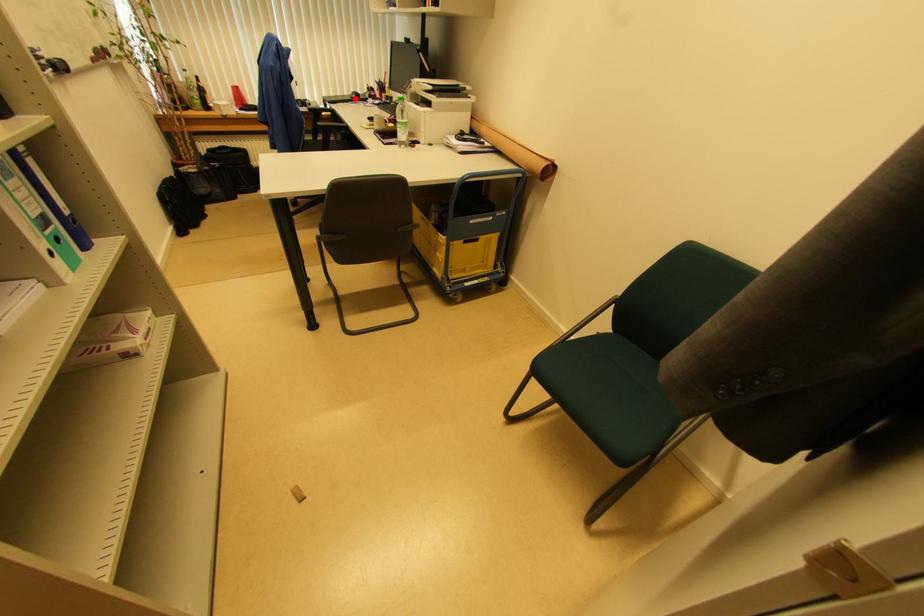
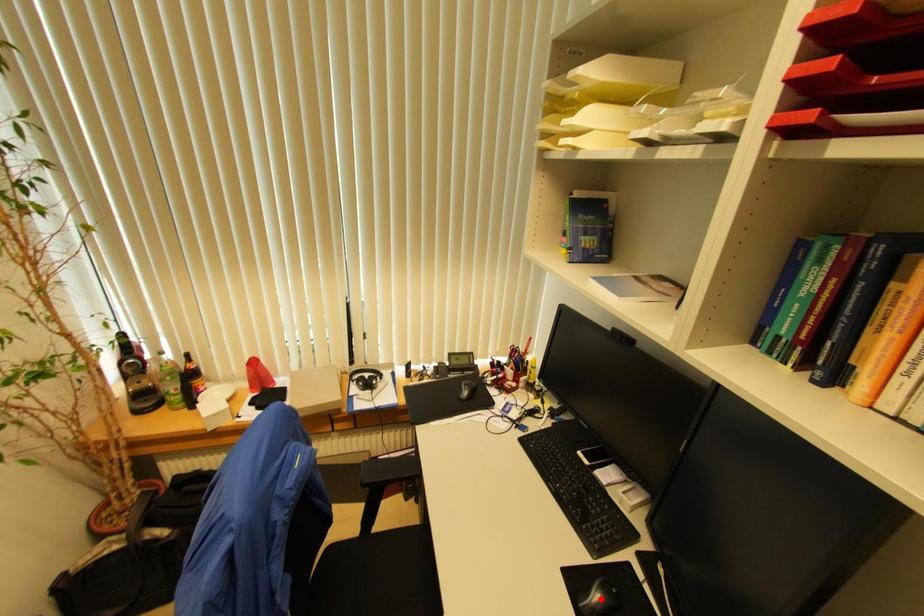
I am providing you with two images of the same scene from different viewpoints. A red point is marked on the first image and another point is marked on the second image. Are the points marked in image1 and image2 representing the same 3D position?

No